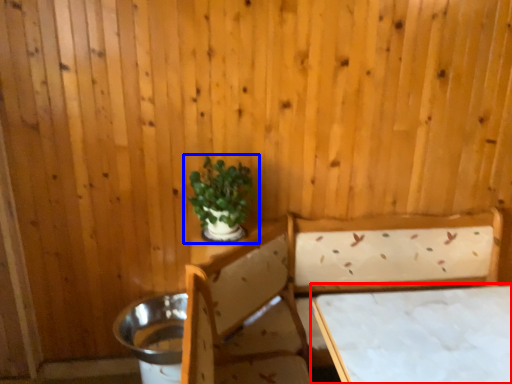
Question: Among these objects, which one is nearest to the camera, table (highlighted by a red box) or houseplant (highlighted by a blue box)?

Choices:
 (A) table
 (B) houseplant

Answer: (A)